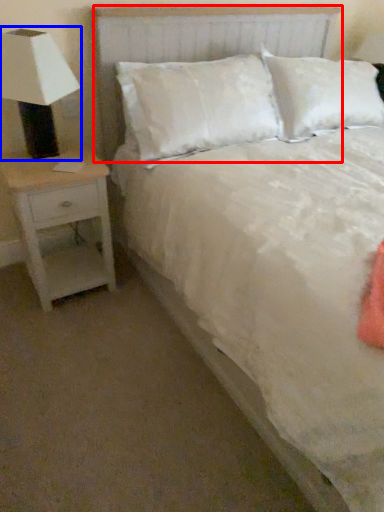
Question: Among these objects, which one is nearest to the camera, headboard (highlighted by a red box) or lamp (highlighted by a blue box)?

Choices:
 (A) headboard
 (B) lamp

Answer: (B)